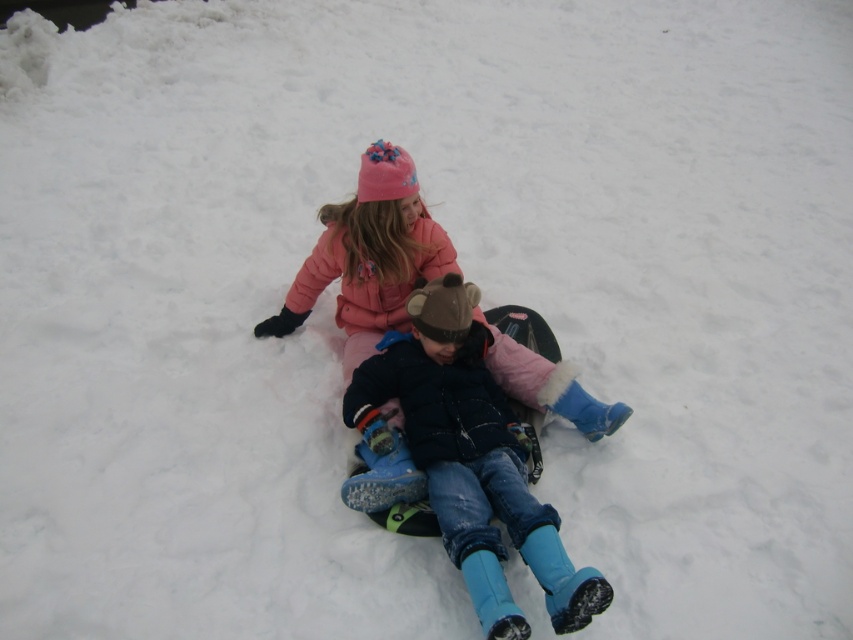
Question: Which point is closer to the camera taking this photo?

Choices:
 (A) (521, 554)
 (B) (544, 369)

Answer: (A)

Question: Is blue fuzzy boots at center smaller than matte pink coat at center?

Choices:
 (A) no
 (B) yes

Answer: (A)

Question: Where is blue fuzzy boots at center located in relation to matte pink coat at center in the image?

Choices:
 (A) right
 (B) left

Answer: (A)

Question: Is blue fuzzy boots at center smaller than matte pink coat at center?

Choices:
 (A) no
 (B) yes

Answer: (A)